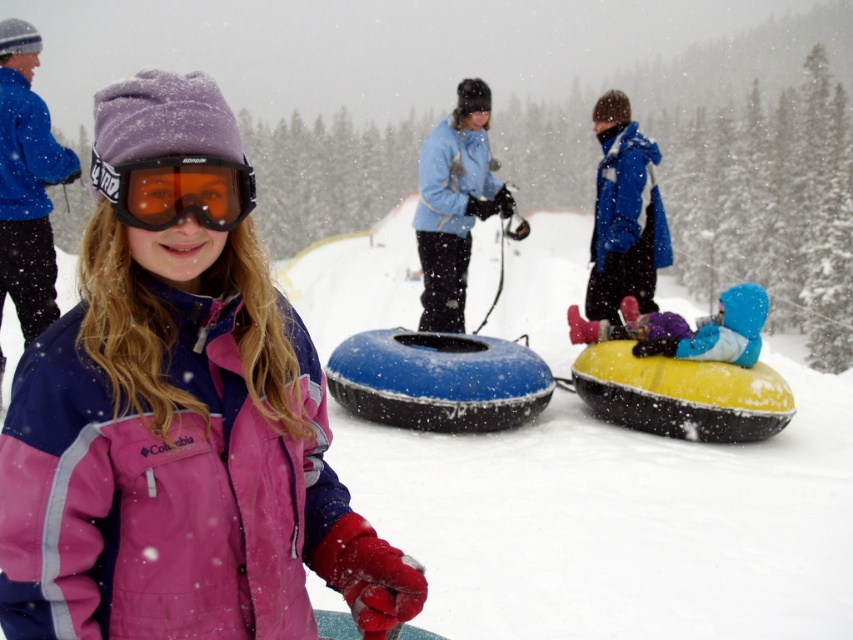
Question: Does white fluffy snow at center have a lesser width compared to black matte goggles at center?

Choices:
 (A) yes
 (B) no

Answer: (B)

Question: Is pink fleece jacket at center to the right of black matte goggles at center from the viewer's perspective?

Choices:
 (A) no
 (B) yes

Answer: (B)

Question: Which point appears farthest from the camera in this image?

Choices:
 (A) (196, 168)
 (B) (715, 332)

Answer: (B)

Question: Which object appears closest to the camera in this image?

Choices:
 (A) white fluffy snow at center
 (B) pink fleece jacket at center
 (C) black matte goggles at center
 (D) blue fabric snowsuit at center

Answer: (C)

Question: Is blue matte jacket at center to the left of black matte goggles at center from the viewer's perspective?

Choices:
 (A) no
 (B) yes

Answer: (A)

Question: Which object appears closest to the camera in this image?

Choices:
 (A) white fluffy snow at center
 (B) black matte goggles at center
 (C) blue fabric snowsuit at center

Answer: (B)